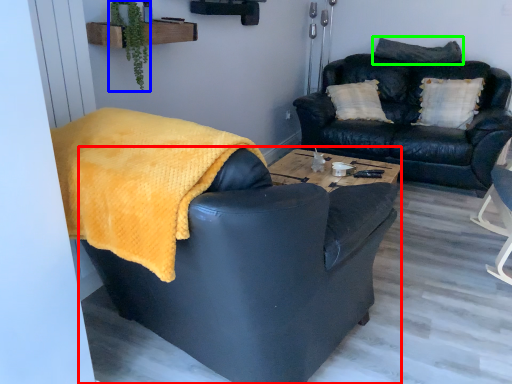
Question: Considering the real-world distances, which object is closest to chair (highlighted by a red box)? plant (highlighted by a blue box) or pillow (highlighted by a green box).

Choices:
 (A) plant
 (B) pillow

Answer: (A)